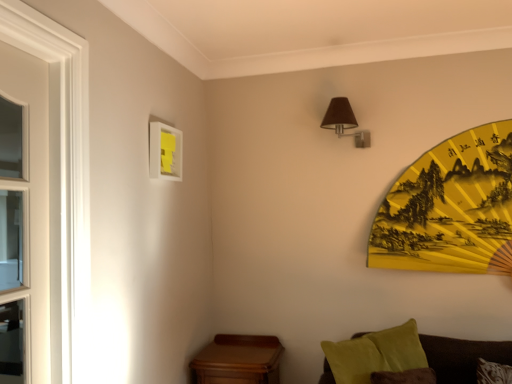
Question: From the image's perspective, is yellow paper fan at upper right above wooden table at lower left?

Choices:
 (A) no
 (B) yes

Answer: (B)

Question: Is yellow paper fan at upper right far from wooden table at lower left?

Choices:
 (A) yes
 (B) no

Answer: (A)

Question: Considering the relative positions of yellow paper fan at upper right and wooden table at lower left in the image provided, is yellow paper fan at upper right to the left of wooden table at lower left from the viewer's perspective?

Choices:
 (A) no
 (B) yes

Answer: (A)

Question: Is yellow paper fan at upper right outside of wooden table at lower left?

Choices:
 (A) yes
 (B) no

Answer: (A)

Question: Can you see yellow paper fan at upper right touching wooden table at lower left?

Choices:
 (A) no
 (B) yes

Answer: (A)

Question: From a real-world perspective, is yellow paper fan at upper right physically above wooden table at lower left?

Choices:
 (A) yes
 (B) no

Answer: (A)

Question: From a real-world perspective, is white matte picture frame at upper left positioned under brown fabric lampshade at upper right based on gravity?

Choices:
 (A) yes
 (B) no

Answer: (A)

Question: Can you confirm if white matte picture frame at upper left is taller than brown fabric lampshade at upper right?

Choices:
 (A) yes
 (B) no

Answer: (A)

Question: Can brown fabric lampshade at upper right be found inside white matte picture frame at upper left?

Choices:
 (A) no
 (B) yes

Answer: (A)

Question: Would you say white matte picture frame at upper left is outside brown fabric lampshade at upper right?

Choices:
 (A) no
 (B) yes

Answer: (B)

Question: Can you confirm if white matte picture frame at upper left is wider than brown fabric lampshade at upper right?

Choices:
 (A) no
 (B) yes

Answer: (A)

Question: Is white matte picture frame at upper left shorter than brown fabric lampshade at upper right?

Choices:
 (A) no
 (B) yes

Answer: (A)

Question: Does brown fabric lampshade at upper right lie in front of yellow paper fan at upper right?

Choices:
 (A) yes
 (B) no

Answer: (B)